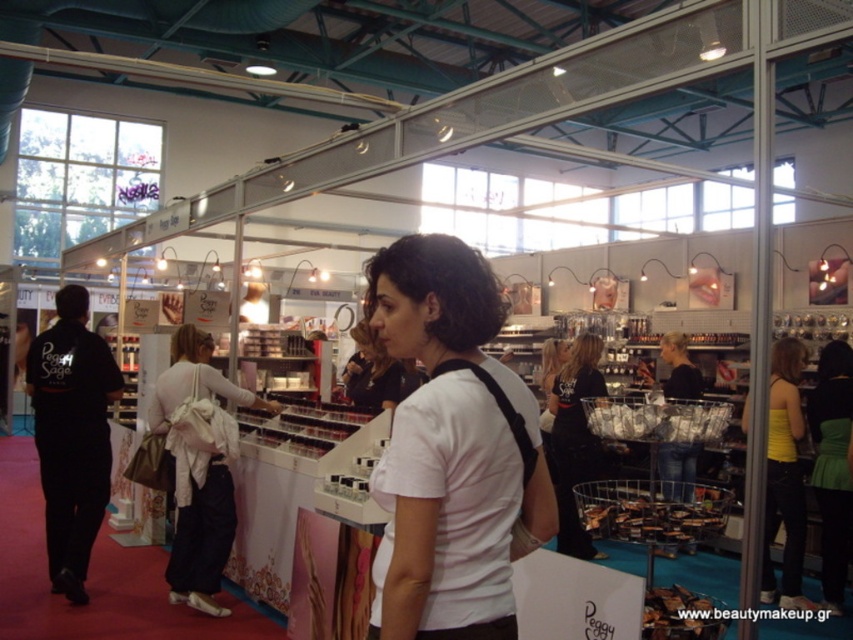
You are a photographer at the trade show and need to capture a clear photo of both the white matte shirt at center and the white fabric bag at center. Since the lighting is bright, you want to ensure neither object is backlit. Based on their positions, which object is closer to the light source?

The white fabric bag at center is taller than the white matte shirt at center, so it is closer to the light source.

You are a visitor at the exhibition hall and want to examine the yellow fabric tank top at center displayed on the counter. Considering your average height, can you comfortably reach it without needing a step stool?

The yellow fabric tank top at center is 4.38 meters from the viewer. Since the distance is quite far, it might be difficult to reach comfortably without assistance. However, the description only provides the distance and not the height from the ground, so we cannot definitively determine reachability based on average height alone.